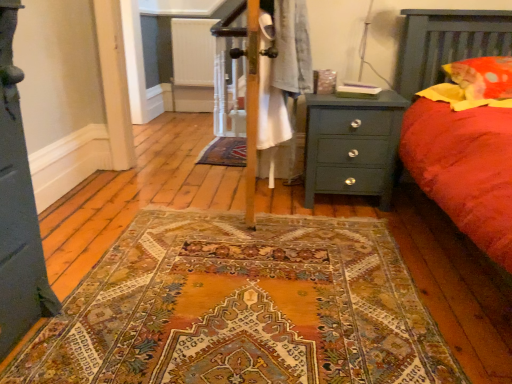
Describe the element at coordinates (193, 51) in the screenshot. I see `white textured radiator at center` at that location.

What do you see at coordinates (483, 77) in the screenshot?
I see `red cotton pillow at upper right` at bounding box center [483, 77].

What do you see at coordinates (352, 146) in the screenshot?
I see `green matte nightstand at right` at bounding box center [352, 146].

Find the location of a particular element. white textured radiator at center is located at coordinates (193, 51).

Could you tell me if red cotton pillow at upper right is turned towards white textured radiator at center?

No, red cotton pillow at upper right is not facing towards white textured radiator at center.

From a real-world perspective, is red cotton pillow at upper right on top of white textured radiator at center?

Yes, from a real-world perspective, red cotton pillow at upper right is above white textured radiator at center.

Is red cotton pillow at upper right at the right side of white textured radiator at center?

Yes.

In the scene shown: Is red cotton pillow at upper right touching white textured radiator at center?

red cotton pillow at upper right and white textured radiator at center are not in contact.

Considering the sizes of objects white textured radiator at center and green matte nightstand at right in the image provided, who is thinner, white textured radiator at center or green matte nightstand at right?

With smaller width is white textured radiator at center.

Can you confirm if white textured radiator at center is bigger than green matte nightstand at right?

Incorrect, white textured radiator at center is not larger than green matte nightstand at right.

Is white textured radiator at center outside of green matte nightstand at right?

Absolutely, white textured radiator at center is external to green matte nightstand at right.

In the scene shown: Is white textured radiator at center oriented away from green matte nightstand at right?

No.

Is red cotton pillow at upper right not within green matte nightstand at right?

Yes.

From a real-world perspective, is red cotton pillow at upper right over green matte nightstand at right?

Indeed, from a real-world perspective, red cotton pillow at upper right stands above green matte nightstand at right.

The height and width of the screenshot is (384, 512). Identify the location of pillow in front of the green matte nightstand at right. (483, 77).

Which of these two, red cotton pillow at upper right or green matte nightstand at right, stands taller?

Standing taller between the two is green matte nightstand at right.

From the image's perspective, which object appears higher, green matte nightstand at right or white textured radiator at center?

white textured radiator at center.

Where is `radiator to the left of green matte nightstand at right`? This screenshot has height=384, width=512. radiator to the left of green matte nightstand at right is located at coordinates (193, 51).

Can you confirm if green matte nightstand at right is thinner than white textured radiator at center?

No, green matte nightstand at right is not thinner than white textured radiator at center.

Are green matte nightstand at right and white textured radiator at center far apart?

Yes.

How different are the orientations of green matte nightstand at right and red cotton pillow at upper right in degrees?

The facing directions of green matte nightstand at right and red cotton pillow at upper right are 0.0783 degrees apart.

This screenshot has height=384, width=512. I want to click on nightstand on the left of red cotton pillow at upper right, so tap(352, 146).

Is point (353, 159) farther from viewer compared to point (504, 95)?

That is True.

From a real-world perspective, relative to red cotton pillow at upper right, is green matte nightstand at right vertically above or below?

From a real-world perspective, green matte nightstand at right is physically below red cotton pillow at upper right.

In the scene shown: Is white textured radiator at center taller or shorter than red cotton pillow at upper right?

In the image, white textured radiator at center appears to be taller than red cotton pillow at upper right.

Is point (176, 34) closer to viewer compared to point (483, 86)?

No, (176, 34) is further to viewer.

Is white textured radiator at center in contact with red cotton pillow at upper right?

They are not placed beside each other.

Locate an element on the screen. This screenshot has height=384, width=512. pillow on the right of white textured radiator at center is located at coordinates (483, 77).

The image size is (512, 384). I want to click on radiator located on the left of green matte nightstand at right, so click(193, 51).

When comparing their distances from red cotton pillow at upper right, does green matte nightstand at right or white textured radiator at center seem further?

The object further to red cotton pillow at upper right is white textured radiator at center.

From the image, which object appears to be farther from green matte nightstand at right, red cotton pillow at upper right or white textured radiator at center?

white textured radiator at center is positioned further to the anchor green matte nightstand at right.

Estimate the real-world distances between objects in this image. Which object is further from white textured radiator at center, red cotton pillow at upper right or green matte nightstand at right?

red cotton pillow at upper right lies further to white textured radiator at center than the other object.

Estimate the real-world distances between objects in this image. Which object is closer to red cotton pillow at upper right, white textured radiator at center or green matte nightstand at right?

green matte nightstand at right lies closer to red cotton pillow at upper right than the other object.

When comparing their distances from white textured radiator at center, does green matte nightstand at right or red cotton pillow at upper right seem further?

red cotton pillow at upper right lies further to white textured radiator at center than the other object.

Which object lies nearer to the anchor point green matte nightstand at right, white textured radiator at center or red cotton pillow at upper right?

red cotton pillow at upper right.

Identify the location of nightstand between red cotton pillow at upper right and white textured radiator at center from front to back. (352, 146).